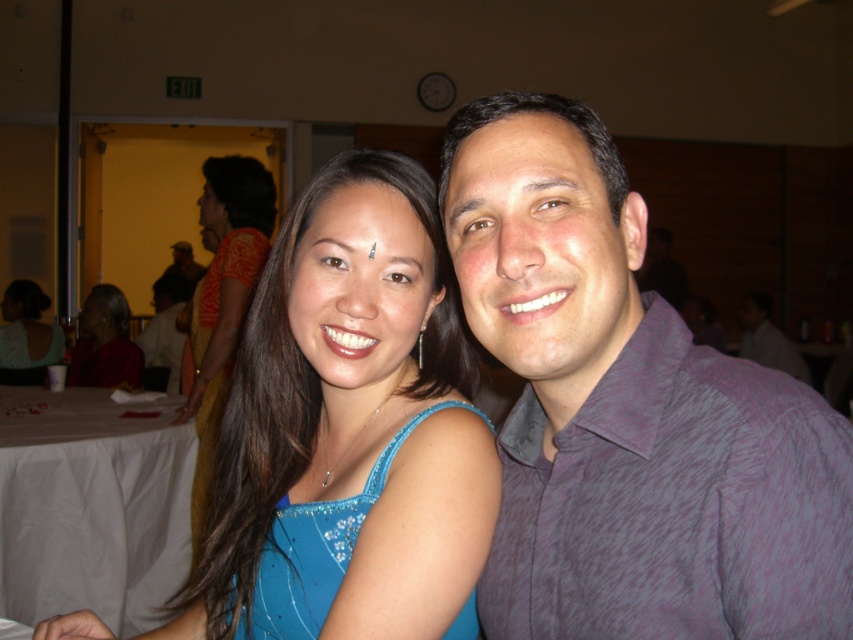
In the scene shown: Does purple textured shirt at right have a smaller size compared to blue silk saree at center?

Yes.

Is purple textured shirt at right below blue silk saree at center?

Actually, purple textured shirt at right is above blue silk saree at center.

Measure the distance between point (x=525, y=504) and camera.

A distance of 75.42 centimeters exists between point (x=525, y=504) and camera.

This screenshot has height=640, width=853. I want to click on purple textured shirt at right, so click(x=628, y=413).

Is blue silk saree at center further to the viewer compared to matte red blouse at lower left?

No, blue silk saree at center is in front of matte red blouse at lower left.

In the scene shown: Can you confirm if blue silk saree at center is positioned below matte red blouse at lower left?

Indeed, blue silk saree at center is positioned under matte red blouse at lower left.

The width and height of the screenshot is (853, 640). I want to click on blue silk saree at center, so click(x=222, y=301).

Where is `blue silk saree at center`? The width and height of the screenshot is (853, 640). blue silk saree at center is located at coordinates tap(222, 301).

Can you confirm if purple textured shirt at right is taller than white cloth at lower left?

Incorrect, purple textured shirt at right's height is not larger of white cloth at lower left's.

Can you confirm if purple textured shirt at right is shorter than white cloth at lower left?

Correct, purple textured shirt at right is not as tall as white cloth at lower left.

Where is `purple textured shirt at right`? purple textured shirt at right is located at coordinates (628, 413).

What are the coordinates of `purple textured shirt at right` in the screenshot? It's located at (628, 413).